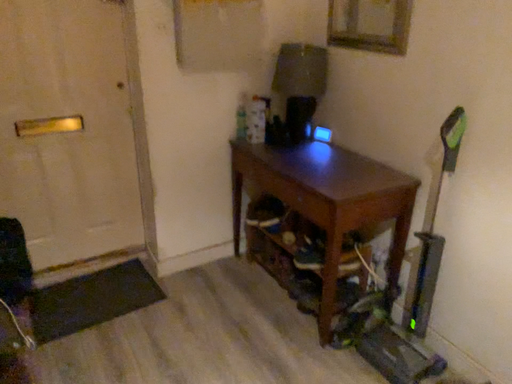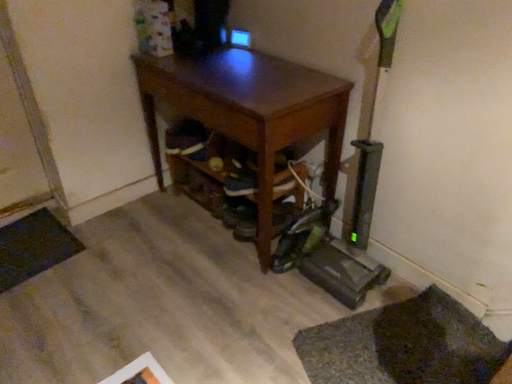
Question: How did the camera likely rotate when shooting the video?

Choices:
 (A) rotated downward
 (B) rotated upward

Answer: (A)